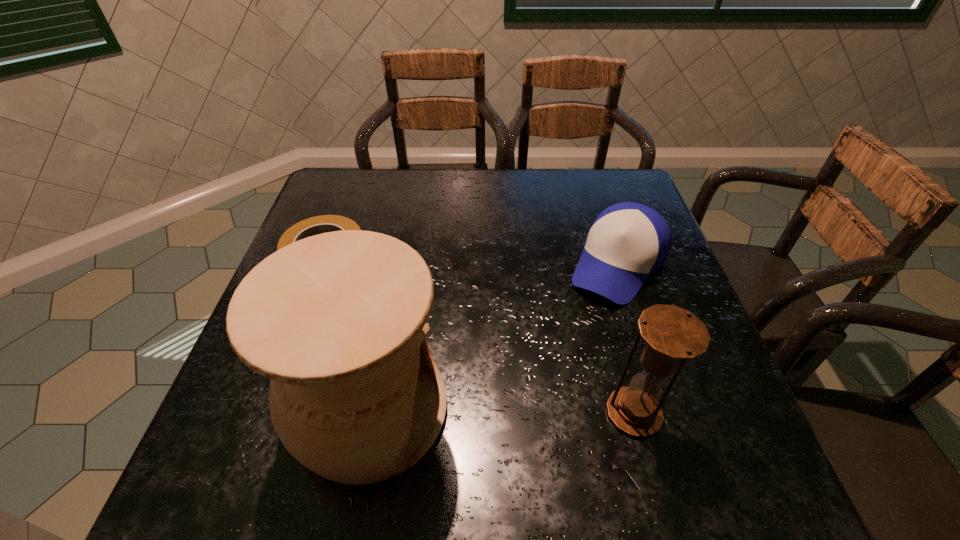
Identify the location of vacant space located 0.070m on the front-facing side of the third tallest object. (585, 319).

The width and height of the screenshot is (960, 540). Identify the location of vacant space located on the front-facing side of the third tallest object. (536, 388).

The image size is (960, 540). Identify the location of pottery present at the near edge. (337, 321).

Where is `hourglass that is at the near edge`? Image resolution: width=960 pixels, height=540 pixels. hourglass that is at the near edge is located at coordinates (671, 333).

This screenshot has height=540, width=960. Find the location of `pottery that is positioned at the left edge`. pottery that is positioned at the left edge is located at coordinates (337, 321).

The image size is (960, 540). Identify the location of duct tape located at the left edge. (316, 225).

Where is `hourglass that is at the right edge`? This screenshot has width=960, height=540. hourglass that is at the right edge is located at coordinates (671, 333).

Locate an element on the screen. baseball cap present at the right edge is located at coordinates (628, 241).

The height and width of the screenshot is (540, 960). Find the location of `object that is positioned at the near left corner`. object that is positioned at the near left corner is located at coordinates (337, 321).

Find the location of a particular element. object that is at the near right corner is located at coordinates (671, 333).